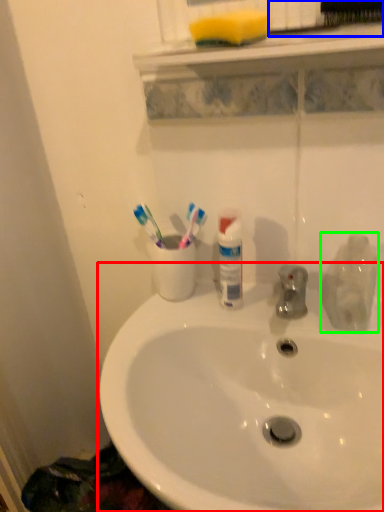
Question: Estimate the real-world distances between objects in this image. Which object is farther from sink (highlighted by a red box), brush (highlighted by a blue box) or cleaning product (highlighted by a green box)?

Choices:
 (A) brush
 (B) cleaning product

Answer: (A)